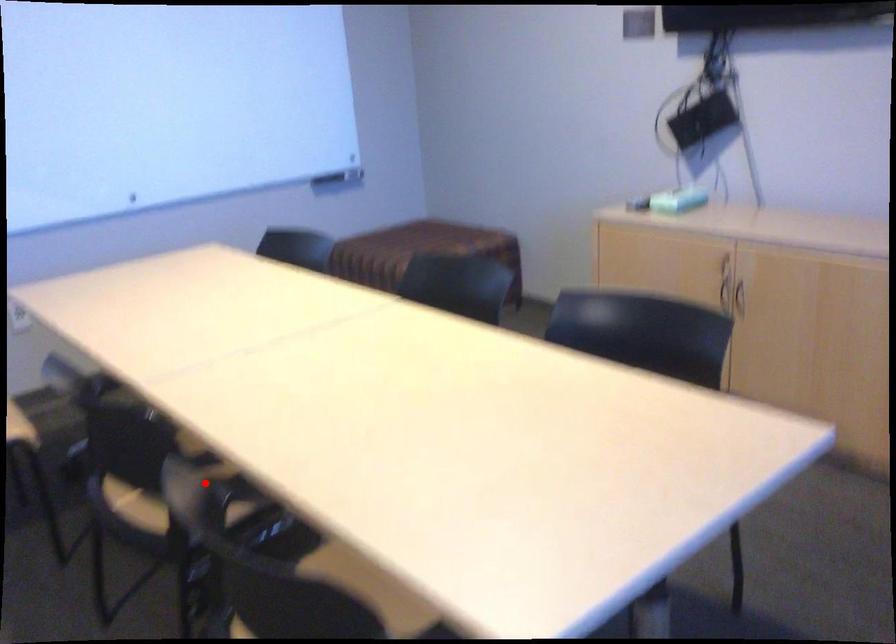
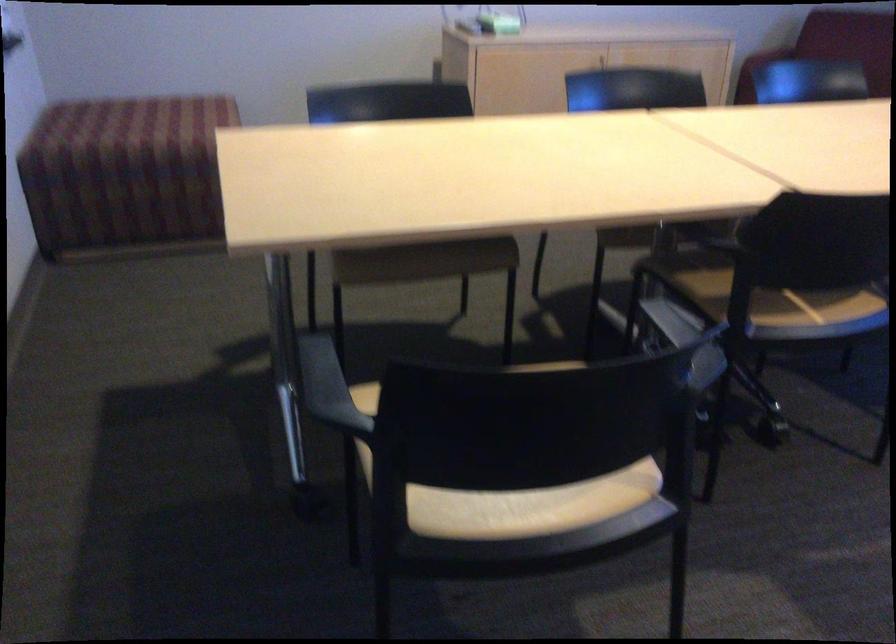
Locate, in the second image, the point that corresponds to the highlighted location in the first image.

(812, 301)